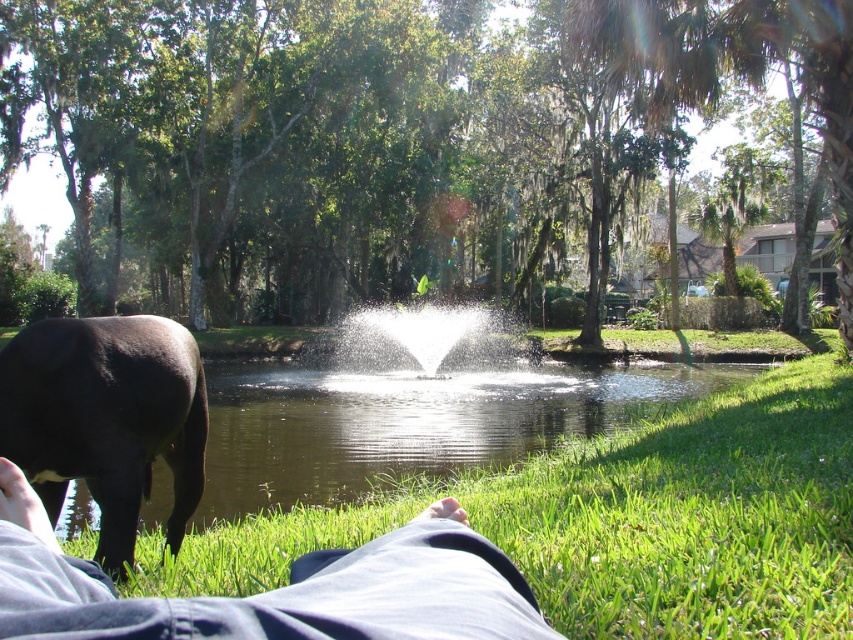
Which of these two, black glossy bull at lower left or white frothy water at center, stands taller?

white frothy water at center is taller.

Does point (119, 356) come behind point (514, 342)?

No, (119, 356) is closer to viewer.

Locate an element on the screen. black glossy bull at lower left is located at coordinates (106, 419).

At what (x,y) coordinates should I click in order to perform the action: click on black glossy bull at lower left. Please return your answer as a coordinate pair (x, y). This screenshot has width=853, height=640. Looking at the image, I should click on (106, 419).

Between green grassy pond at center and black glossy bull at lower left, which one has more height?

black glossy bull at lower left is taller.

Between green grassy pond at center and black glossy bull at lower left, which one is positioned higher?

black glossy bull at lower left

Image resolution: width=853 pixels, height=640 pixels. Find the location of `green grassy pond at center`. green grassy pond at center is located at coordinates (409, 422).

At what (x,y) coordinates should I click in order to perform the action: click on green grassy pond at center. Please return your answer as a coordinate pair (x, y). The image size is (853, 640). Looking at the image, I should click on (409, 422).

Can you confirm if green grassy pond at center is positioned to the right of white frothy water at center?

No, green grassy pond at center is not to the right of white frothy water at center.

Can you confirm if green grassy pond at center is taller than white frothy water at center?

In fact, green grassy pond at center may be shorter than white frothy water at center.

Locate an element on the screen. This screenshot has height=640, width=853. green grassy pond at center is located at coordinates (409, 422).